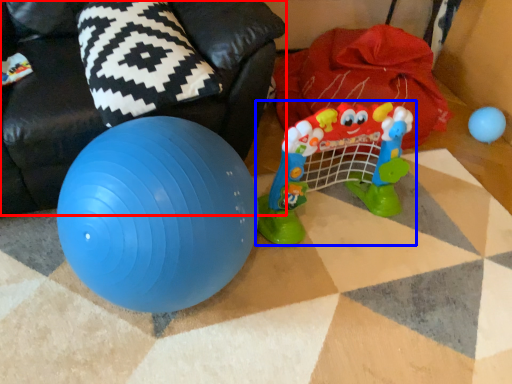
Question: Which point is closer to the camera, bean bag chair (highlighted by a red box) or toy (highlighted by a blue box)?

Choices:
 (A) bean bag chair
 (B) toy

Answer: (A)